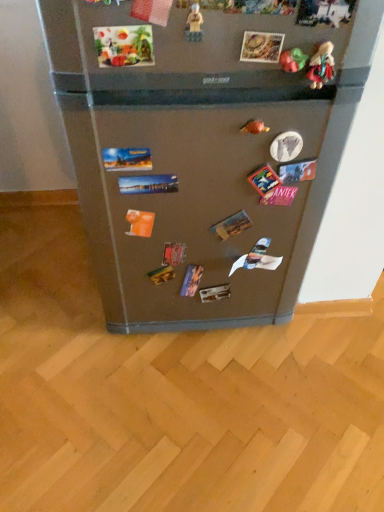
Question: Is matte plastic toy at upper right, arranged as the second toy when viewed from the right, to the left of rubber duck at upper right, placed as the second toy when sorted from left to right, from the viewer's perspective?

Choices:
 (A) no
 (B) yes

Answer: (A)

Question: Considering the relative positions of matte plastic toy at upper right, arranged as the second toy when viewed from the right, and rubber duck at upper right, placed as the fourth toy when sorted from front to back, in the image provided, is matte plastic toy at upper right, arranged as the second toy when viewed from the right, to the right of rubber duck at upper right, placed as the fourth toy when sorted from front to back, from the viewer's perspective?

Choices:
 (A) no
 (B) yes

Answer: (B)

Question: Considering the relative sizes of matte plastic toy at upper right, which ranks as the 3th toy in front-to-back order, and rubber duck at upper right, placed as the fourth toy when sorted from front to back, in the image provided, is matte plastic toy at upper right, which ranks as the 3th toy in front-to-back order, wider than rubber duck at upper right, placed as the fourth toy when sorted from front to back,?

Choices:
 (A) yes
 (B) no

Answer: (B)

Question: Can you confirm if matte plastic toy at upper right, arranged as the second toy when viewed from the right, is bigger than rubber duck at upper right, placed as the second toy when sorted from left to right?

Choices:
 (A) yes
 (B) no

Answer: (B)

Question: Considering the relative sizes of matte plastic toy at upper right, placed as the second toy when sorted from back to front, and rubber duck at upper right, placed as the fourth toy when sorted from front to back, in the image provided, is matte plastic toy at upper right, placed as the second toy when sorted from back to front, thinner than rubber duck at upper right, placed as the fourth toy when sorted from front to back,?

Choices:
 (A) no
 (B) yes

Answer: (B)

Question: Is point (332, 50) closer or farther from the camera than point (170, 232)?

Choices:
 (A) farther
 (B) closer

Answer: (B)

Question: Is matte plastic doll at upper right, which is the 2th toy in front-to-back order, wider or thinner than satin silver fridge at center?

Choices:
 (A) wide
 (B) thin

Answer: (A)

Question: Would you say matte plastic doll at upper right, the third toy viewed from the back, is inside or outside satin silver fridge at center?

Choices:
 (A) inside
 (B) outside

Answer: (A)

Question: From a real-world perspective, relative to satin silver fridge at center, is matte plastic doll at upper right, which ranks as the 1th toy in right-to-left order, vertically above or below?

Choices:
 (A) above
 (B) below

Answer: (A)

Question: In terms of height, does rubber duck at upper right, placed as the second toy when sorted from left to right, look taller or shorter compared to satin silver fridge at center?

Choices:
 (A) tall
 (B) short

Answer: (B)

Question: In terms of width, does rubber duck at upper right, marked as the 1th toy in a back-to-front arrangement, look wider or thinner when compared to satin silver fridge at center?

Choices:
 (A) wide
 (B) thin

Answer: (A)

Question: From a real-world perspective, is rubber duck at upper right, positioned as the 3th toy in right-to-left order, above or below satin silver fridge at center?

Choices:
 (A) below
 (B) above

Answer: (B)

Question: Is rubber duck at upper right, placed as the second toy when sorted from left to right, spatially inside satin silver fridge at center, or outside of it?

Choices:
 (A) outside
 (B) inside

Answer: (B)

Question: Considering the positions of translucent plastic toy at upper center, arranged as the 1th toy when viewed from the left, and matte plastic doll at upper right, which is the 2th toy in front-to-back order, in the image, is translucent plastic toy at upper center, arranged as the 1th toy when viewed from the left, bigger or smaller than matte plastic doll at upper right, which is the 2th toy in front-to-back order,?

Choices:
 (A) small
 (B) big

Answer: (A)

Question: Visually, is translucent plastic toy at upper center, placed as the fourth toy when sorted from right to left, positioned to the left or to the right of matte plastic doll at upper right, which ranks as the 1th toy in right-to-left order?

Choices:
 (A) right
 (B) left

Answer: (B)